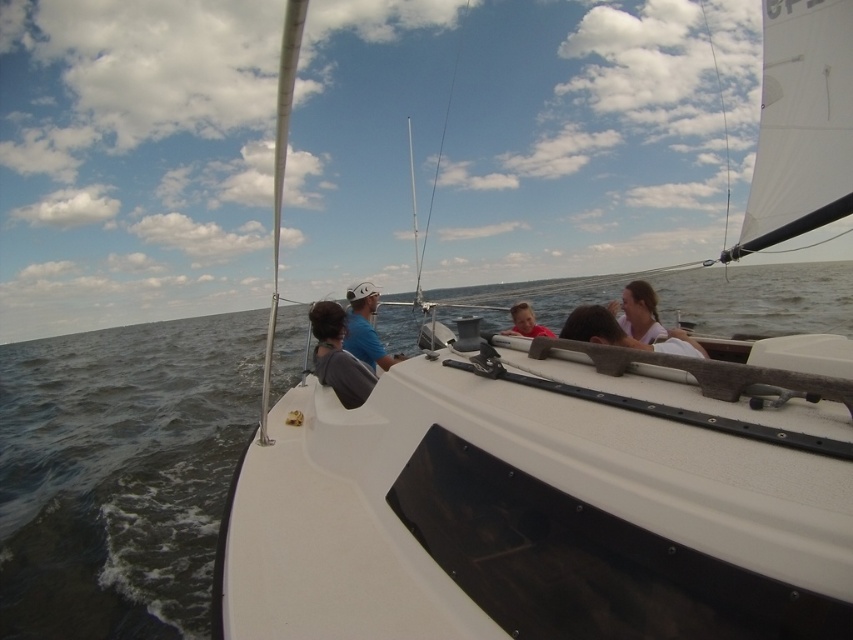
Question: Is pink fabric at center below pink fabric hair at upper right?

Choices:
 (A) no
 (B) yes

Answer: (B)

Question: Does pink fabric hair at upper right appear over matte pink shirt at center?

Choices:
 (A) yes
 (B) no

Answer: (A)

Question: Considering the real-world distances, which object is closest to the pink fabric at center?

Choices:
 (A) white fabric shirt at center
 (B) dark blue water at center
 (C) matte pink shirt at center

Answer: (A)

Question: Can you confirm if matte blue shirt at center is thinner than pink fabric hair at upper right?

Choices:
 (A) no
 (B) yes

Answer: (A)

Question: Which point is closer to the camera?

Choices:
 (A) pink fabric hair at upper right
 (B) matte blue shirt at center
 (C) matte pink shirt at center
 (D) dark blue water at center

Answer: (D)

Question: Based on their relative distances, which object is farther from the matte blue shirt at center?

Choices:
 (A) dark blue water at center
 (B) white fabric shirt at center
 (C) matte gray shirt at center

Answer: (A)